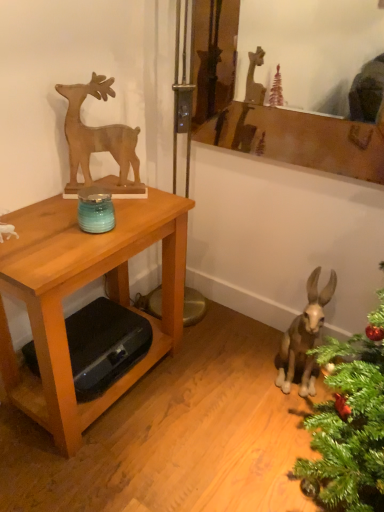
At what (x,y) coordinates should I click in order to perform the action: click on free space in front of wooden table at left. Please return your answer as a coordinate pair (x, y). Image resolution: width=384 pixels, height=512 pixels. Looking at the image, I should click on (102, 470).